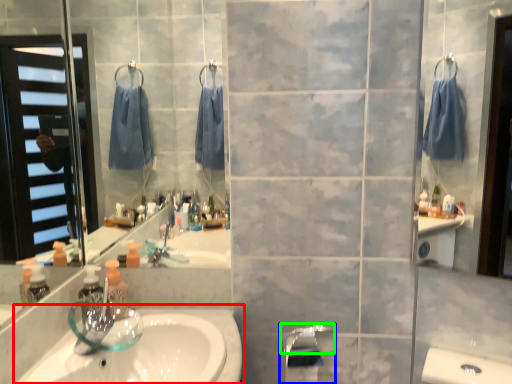
Question: Which is nearer to the sink (highlighted by a red box)? tap (highlighted by a blue box) or faucet (highlighted by a green box).

Choices:
 (A) tap
 (B) faucet

Answer: (A)